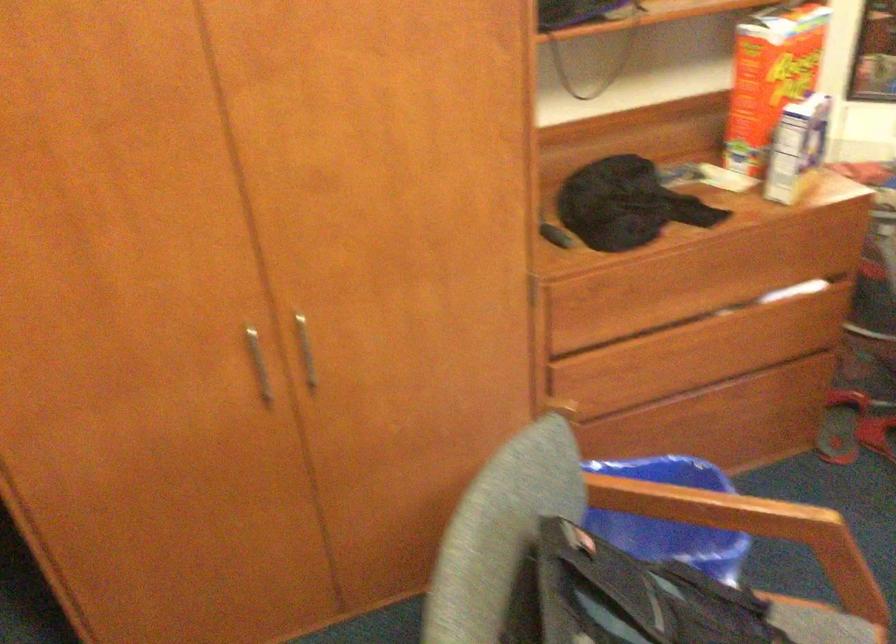
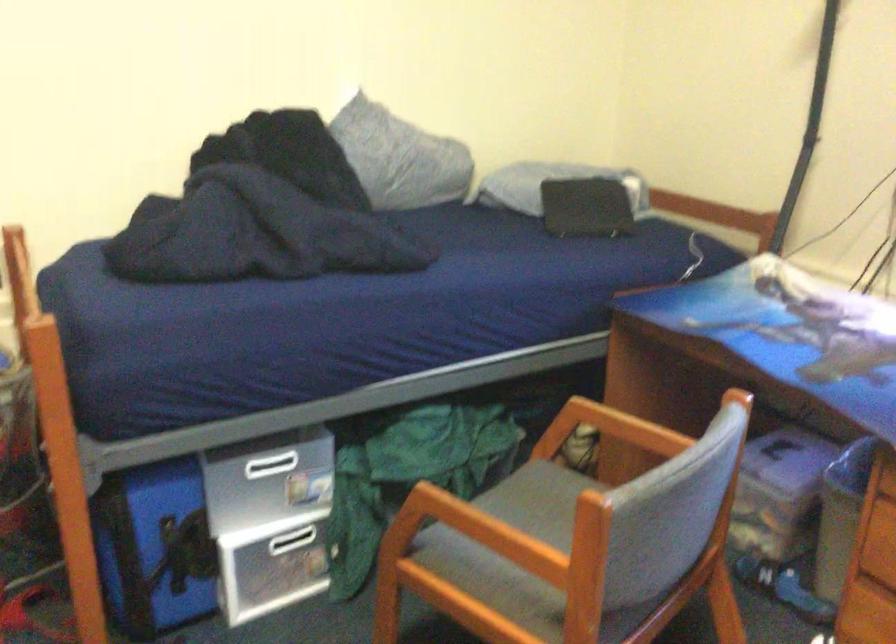
Question: The camera is either moving clockwise (left) or counter-clockwise (right) around the object. The first image is from the beginning of the video and the second image is from the end. Is the camera moving left or right when shooting the video?

Choices:
 (A) Left
 (B) Right

Answer: (A)